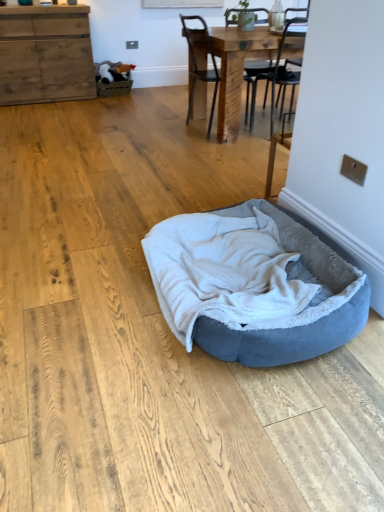
Locate an element on the screen. This screenshot has height=512, width=384. free space that is to the left of black metal chair at upper center is located at coordinates (158, 129).